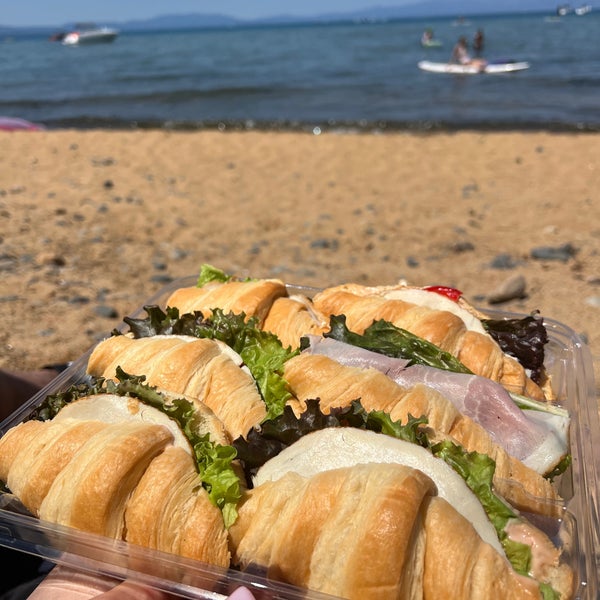
Image resolution: width=600 pixels, height=600 pixels. In order to click on plastic tray holder in this screenshot , I will do `click(127, 566)`.